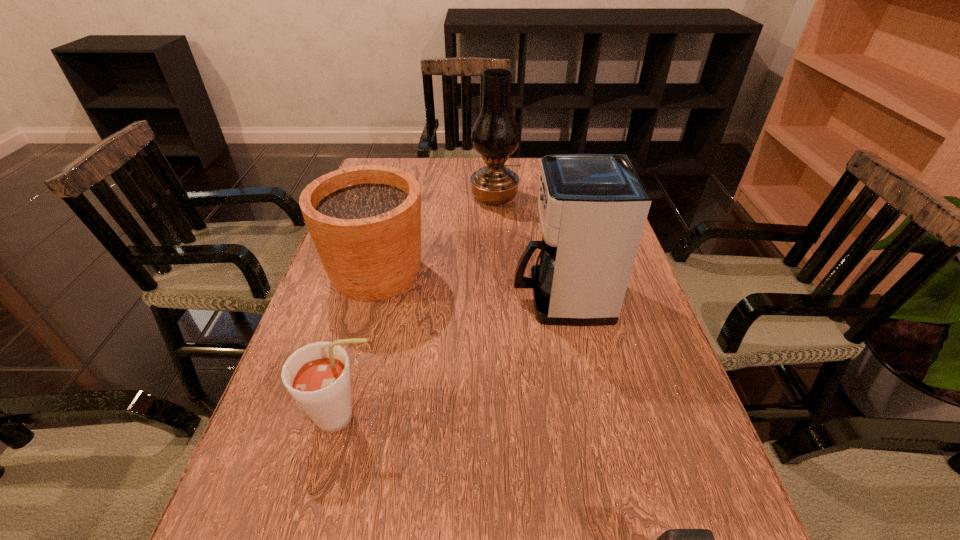
Locate an element on the screen. The width and height of the screenshot is (960, 540). free point between the root beer and the coffee maker is located at coordinates (452, 357).

The height and width of the screenshot is (540, 960). In order to click on vacant space that's between the fourth tallest object and the flowerpot in this screenshot , I will do `click(360, 345)`.

Find the location of a particular element. free space that is in between the flowerpot and the coffee maker is located at coordinates (468, 286).

You are a GUI agent. You are given a task and a screenshot of the screen. Output one action in this format:
    pyautogui.click(x=<x>, y=<y>)
    Task: Click on the fourth closest object to the flowerpot
    The width and height of the screenshot is (960, 540).
    Given the screenshot: What is the action you would take?
    pyautogui.click(x=674, y=539)

Identify which object is located as the fourth nearest to the oil lamp. Please provide its 2D coordinates. Your answer should be formatted as a tuple, i.e. [(x, y)], where the tuple contains the x and y coordinates of a point satisfying the conditions above.

[(674, 539)]